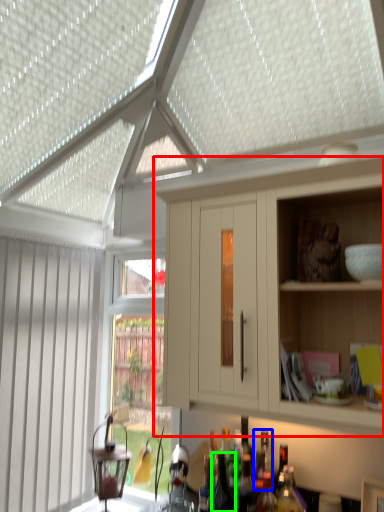
Question: Based on their relative distances, which object is nearer to cabinetry (highlighted by a red box)? Choose from bottle (highlighted by a blue box) and bottle (highlighted by a green box).

Choices:
 (A) bottle
 (B) bottle

Answer: (A)